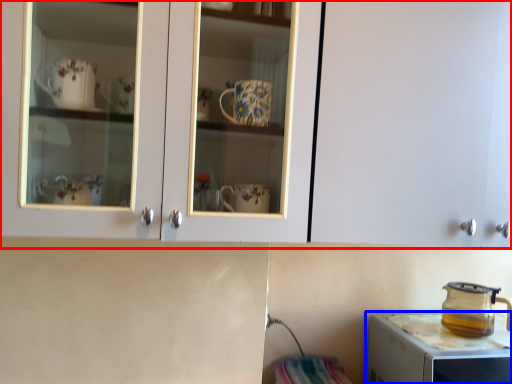
Question: Which of the following is the closest to the observer, cabinetry (highlighted by a red box) or home appliance (highlighted by a blue box)?

Choices:
 (A) cabinetry
 (B) home appliance

Answer: (A)